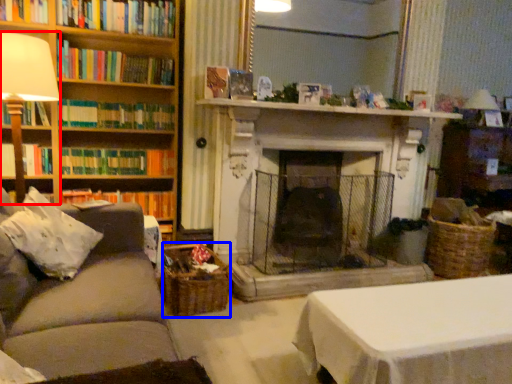
Question: Which object appears farthest to the camera in this image, table lamp (highlighted by a red box) or basket (highlighted by a blue box)?

Choices:
 (A) table lamp
 (B) basket

Answer: (B)